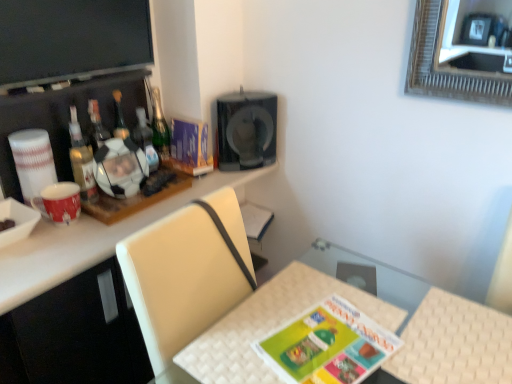
Question: Based on their positions, is matte green board game at center located to the left or right of translucent glass bottle at left, which is the first bottle from left to right?

Choices:
 (A) left
 (B) right

Answer: (B)

Question: Looking at their shapes, would you say matte green board game at center is wider or thinner than translucent glass bottle at left, which is the first bottle from left to right?

Choices:
 (A) thin
 (B) wide

Answer: (B)

Question: Based on their relative distances, which object is farther from the white glossy soccer ball at upper left, which appears as the third bottle when viewed from the right?

Choices:
 (A) flat matte screen at upper left
 (B) green glass bottle at upper center, which appears as the 1th bottle when viewed from the right
 (C) matte purple magazine at upper center
 (D) matte green board game at center
 (E) white glossy desk at upper left

Answer: (D)

Question: Considering the real-world distances, which object is closest to the white matte bowl at left?

Choices:
 (A) translucent glass bottle at upper left, which is the 3th bottle from left to right
 (B) white glossy desk at upper left
 (C) matte red cup at left
 (D) white glossy soccer ball at upper left, placed as the second bottle when sorted from left to right
 (E) white woven table at lower center

Answer: (C)